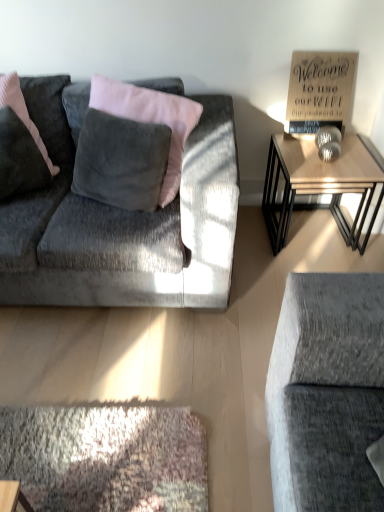
Question: Is wooden sign at upper right positioned before velvet gray couch at left?

Choices:
 (A) no
 (B) yes

Answer: (A)

Question: From the image's perspective, is wooden sign at upper right located above velvet gray couch at left?

Choices:
 (A) no
 (B) yes

Answer: (B)

Question: Is wooden sign at upper right positioned beyond the bounds of velvet gray couch at left?

Choices:
 (A) no
 (B) yes

Answer: (B)

Question: Is wooden sign at upper right wider than velvet gray couch at left?

Choices:
 (A) no
 (B) yes

Answer: (A)

Question: Is wooden sign at upper right to the right of velvet gray couch at left from the viewer's perspective?

Choices:
 (A) no
 (B) yes

Answer: (B)

Question: Is wooden sign at upper right facing towards velvet gray couch at left?

Choices:
 (A) yes
 (B) no

Answer: (B)

Question: Considering the relative positions of wooden table at right and velvet dark gray pillow at left in the image provided, is wooden table at right behind velvet dark gray pillow at left?

Choices:
 (A) no
 (B) yes

Answer: (B)

Question: Does wooden table at right have a lesser height compared to velvet dark gray pillow at left?

Choices:
 (A) no
 (B) yes

Answer: (B)

Question: Is the position of wooden table at right less distant than that of velvet dark gray pillow at left?

Choices:
 (A) yes
 (B) no

Answer: (B)

Question: Can you confirm if wooden table at right is smaller than velvet dark gray pillow at left?

Choices:
 (A) no
 (B) yes

Answer: (A)

Question: Is wooden table at right aimed at velvet dark gray pillow at left?

Choices:
 (A) no
 (B) yes

Answer: (A)

Question: Can you confirm if wooden table at right is positioned to the left of velvet dark gray pillow at left?

Choices:
 (A) yes
 (B) no

Answer: (B)

Question: From the image's perspective, is wooden sign at upper right under velvet dark gray pillow at left?

Choices:
 (A) yes
 (B) no

Answer: (B)